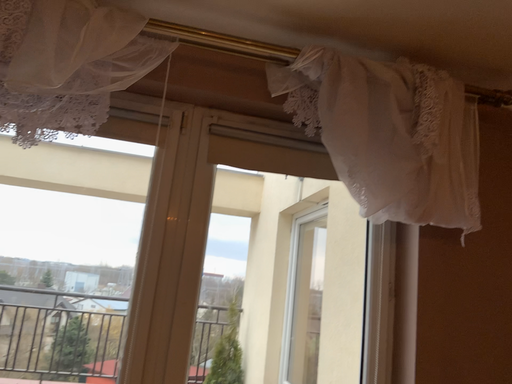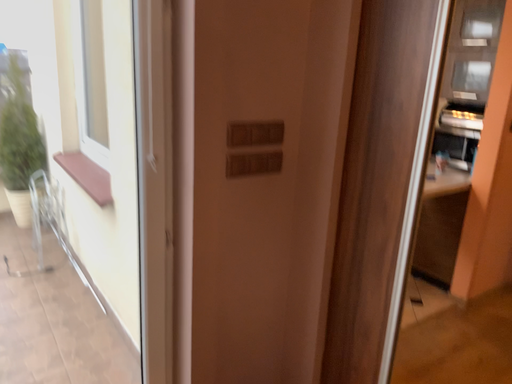
Question: Which way did the camera rotate in the video?

Choices:
 (A) rotated upward
 (B) rotated downward

Answer: (B)